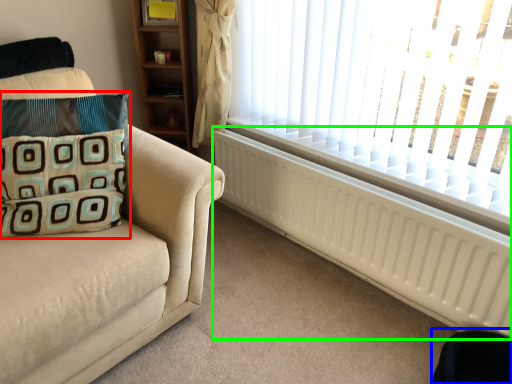
Question: Considering the real-world distances, which object is farthest from pillow (highlighted by a red box)? swivel chair (highlighted by a blue box) or radiator (highlighted by a green box)?

Choices:
 (A) swivel chair
 (B) radiator

Answer: (A)